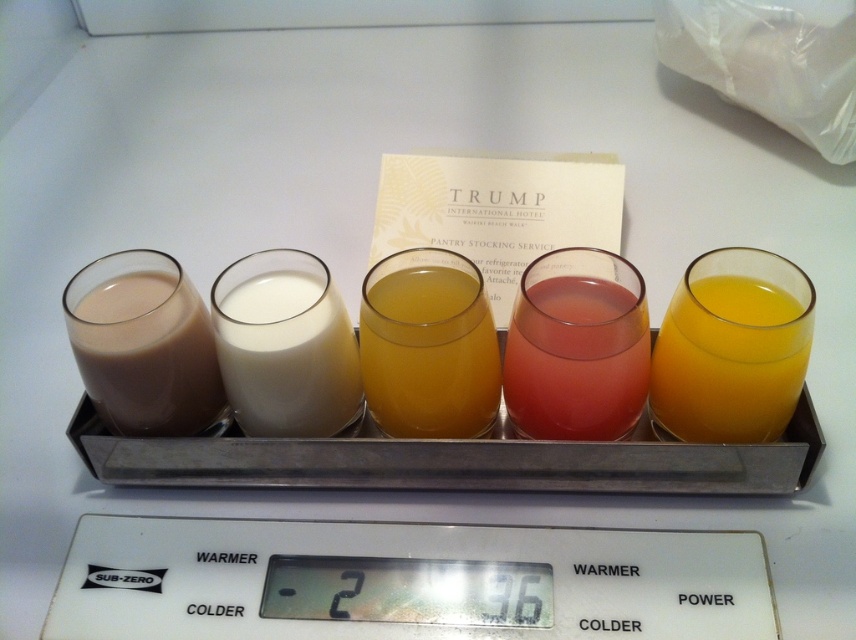
Between white plastic scale at lower center and translucent pink liquid at center, which one has less height?

white plastic scale at lower center

Which is in front, point (440, 600) or point (506, 392)?

Point (440, 600)

Identify the location of white plastic scale at lower center. Image resolution: width=856 pixels, height=640 pixels. (405, 580).

Is matte brown liquid at left behind white creamy milk at center?

Yes, it is.

Between matte brown liquid at left and white creamy milk at center, which one is positioned lower?

white creamy milk at center is below.

I want to click on matte brown liquid at left, so click(144, 346).

Which is behind, point (749, 349) or point (623, 380)?

The point (623, 380) is more distant.

Which is more to the right, translucent yellow liquid at right or translucent pink liquid at center?

translucent yellow liquid at right is more to the right.

Which is behind, point (765, 413) or point (639, 288)?

The point (765, 413) is more distant.

This screenshot has width=856, height=640. In order to click on translucent yellow liquid at right in this screenshot , I will do coord(730,358).